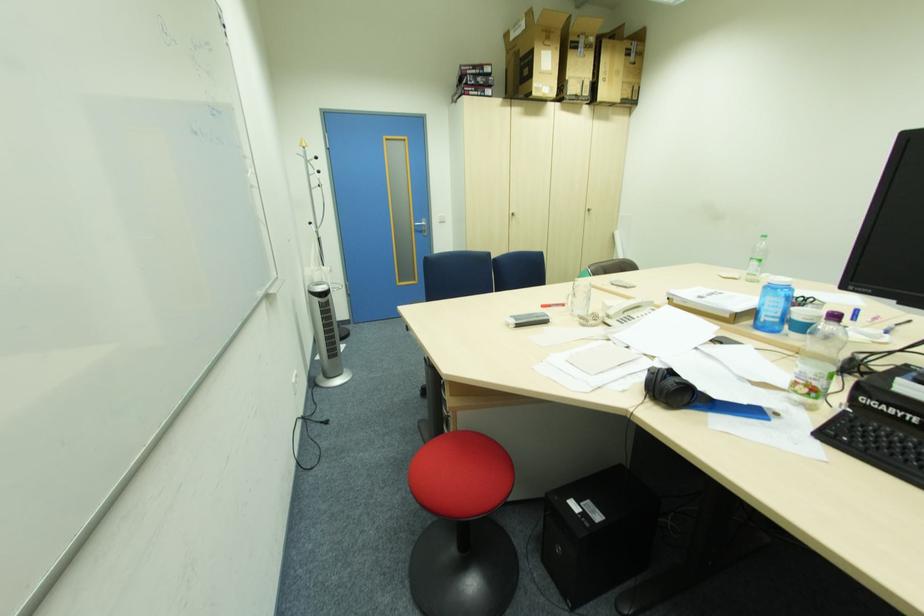
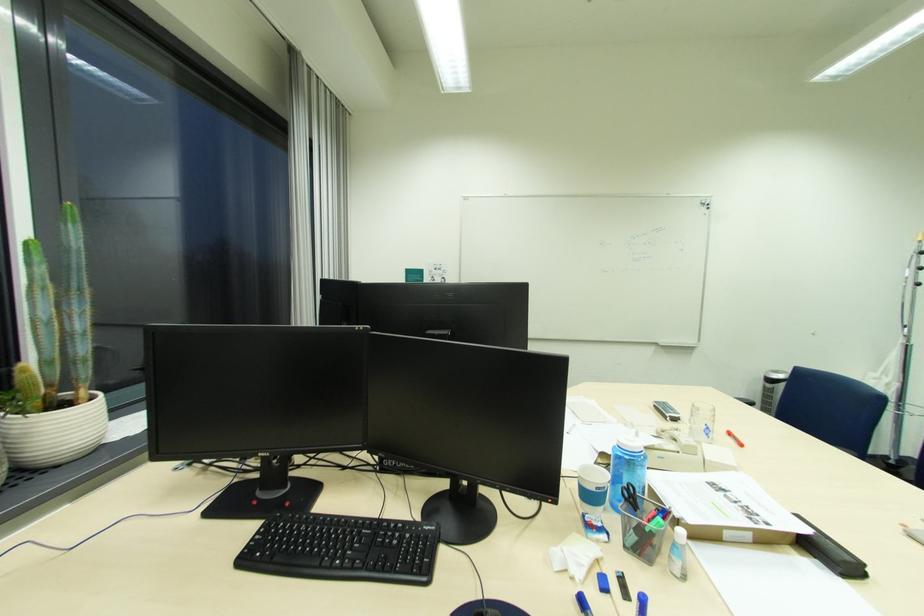
Find the pixel in the second image that matches pixel 323 286 in the first image.

(782, 373)